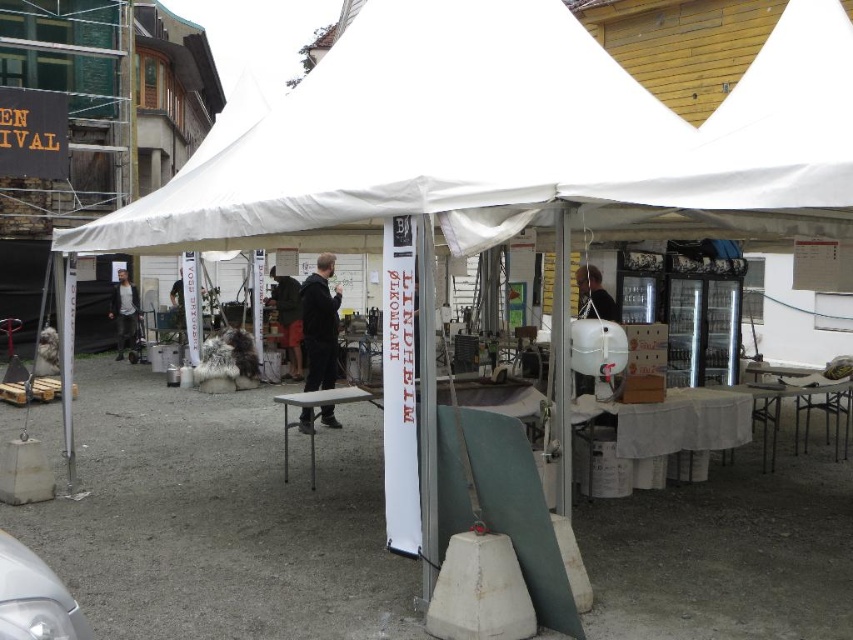
Who is more forward, (184,225) or (279,330)?

Point (184,225) is in front.

Image resolution: width=853 pixels, height=640 pixels. What do you see at coordinates (512, 140) in the screenshot?
I see `white fabric canopy at upper center` at bounding box center [512, 140].

Does point (113, 244) come in front of point (299, 291)?

That is True.

At what (x,y) coordinates should I click in order to perform the action: click on white fabric canopy at upper center. Please return your answer as a coordinate pair (x, y). The width and height of the screenshot is (853, 640). Looking at the image, I should click on (512, 140).

Between black fabric jacket at center and dark brown leather jacket at center, which one appears on the right side from the viewer's perspective?

black fabric jacket at center is more to the right.

Is point (309, 384) positioned after point (300, 317)?

No, (309, 384) is in front of (300, 317).

Find the location of a particular element. This screenshot has width=853, height=640. black fabric jacket at center is located at coordinates (318, 324).

Is point (611, 312) farther from viewer compared to point (137, 305)?

No, it is not.

Between point (596, 285) and point (125, 339), which one is positioned in front?

Point (596, 285) is more forward.

Find the location of a particular element. The image size is (853, 640). matte white balloon at center-right is located at coordinates (595, 296).